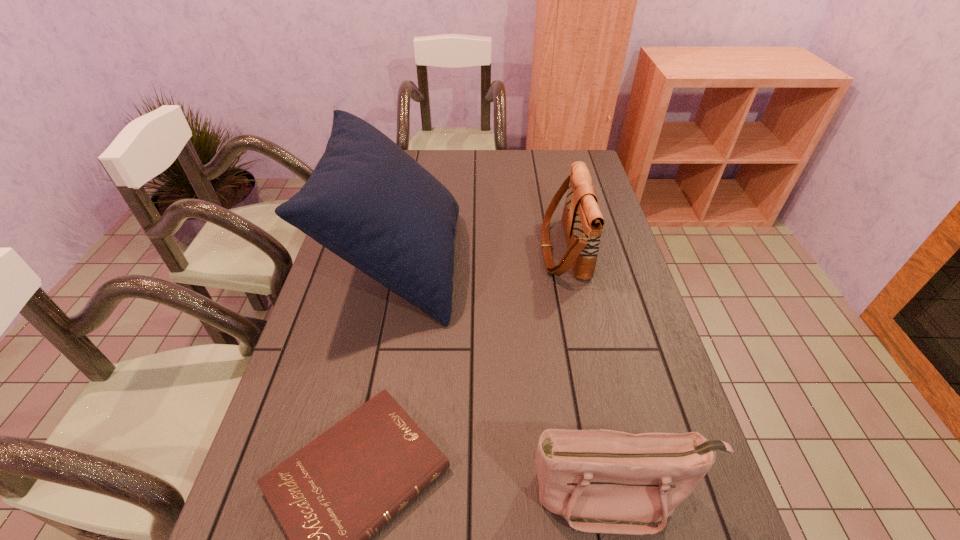
The height and width of the screenshot is (540, 960). In the image, there is a desktop. Find the location of `blank space at the far edge`. blank space at the far edge is located at coordinates (550, 171).

You are a GUI agent. You are given a task and a screenshot of the screen. Output one action in this format:
    pyautogui.click(x=<x>, y=<y>)
    Task: Click on the blank space at the left edge of the desktop
    This screenshot has width=960, height=540.
    Given the screenshot: What is the action you would take?
    pyautogui.click(x=343, y=389)

You are a GUI agent. You are given a task and a screenshot of the screen. Output one action in this format:
    pyautogui.click(x=<x>, y=<y>)
    Task: Click on the vacant area at the right edge
    
    Given the screenshot: What is the action you would take?
    pyautogui.click(x=607, y=266)

At what (x,y) coordinates should I click in order to perform the action: click on free space at the far right corner of the desktop. Please return your answer as a coordinate pair (x, y). This screenshot has width=960, height=540. Looking at the image, I should click on point(564,179).

Where is `free area in between the cushion and the third shortest object`? free area in between the cushion and the third shortest object is located at coordinates (481, 256).

You are a GUI agent. You are given a task and a screenshot of the screen. Output one action in this format:
    pyautogui.click(x=<x>, y=<y>)
    Task: Click on the free spot between the shorter shoulder bag and the third shortest object
    
    Given the screenshot: What is the action you would take?
    pyautogui.click(x=589, y=372)

You are a GUI agent. You are given a task and a screenshot of the screen. Output one action in this format:
    pyautogui.click(x=<x>, y=<y>)
    Task: Click on the vacant area between the third tallest object and the tallest object
    This screenshot has width=960, height=540.
    Given the screenshot: What is the action you would take?
    pyautogui.click(x=506, y=378)

The height and width of the screenshot is (540, 960). Identify the location of free area in between the second tallest object and the shorter shoulder bag. (589, 372).

At what (x,y) coordinates should I click in order to perform the action: click on vacant area between the cushion and the nearer shoulder bag. Please return your answer as a coordinate pair (x, y). The height and width of the screenshot is (540, 960). Looking at the image, I should click on (506, 378).

Image resolution: width=960 pixels, height=540 pixels. Identify the location of the second closest object to the cushion. (582, 220).